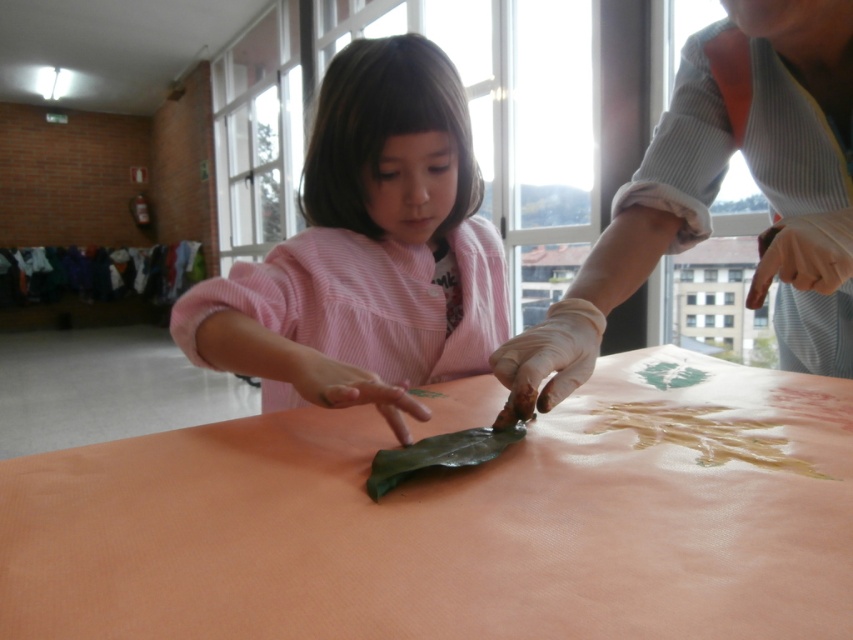
Which is more to the left, pink striped sweater at center or white rubber glove at upper right?

pink striped sweater at center is more to the left.

Is pink striped sweater at center to the left of white rubber glove at upper right from the viewer's perspective?

Yes, pink striped sweater at center is to the left of white rubber glove at upper right.

The height and width of the screenshot is (640, 853). I want to click on pink striped sweater at center, so click(367, 250).

You are a GUI agent. You are given a task and a screenshot of the screen. Output one action in this format:
    pyautogui.click(x=<x>, y=<y>)
    Task: Click on the pink striped sweater at center
    
    Given the screenshot: What is the action you would take?
    pyautogui.click(x=367, y=250)

Does pink striped sweater at center appear on the left side of green rubber leaf at center?

Correct, you'll find pink striped sweater at center to the left of green rubber leaf at center.

Is pink striped sweater at center smaller than green rubber leaf at center?

Incorrect, pink striped sweater at center is not smaller in size than green rubber leaf at center.

The width and height of the screenshot is (853, 640). Describe the element at coordinates (367, 250) in the screenshot. I see `pink striped sweater at center` at that location.

Locate an element on the screen. pink striped sweater at center is located at coordinates (367, 250).

Who is more distant from viewer, (x=140, y=538) or (x=386, y=476)?

Point (x=386, y=476)

Can you confirm if orange matte table at center is wider than green rubber leaf at center?

Correct, the width of orange matte table at center exceeds that of green rubber leaf at center.

Find the location of a particular element. Image resolution: width=853 pixels, height=640 pixels. orange matte table at center is located at coordinates (456, 522).